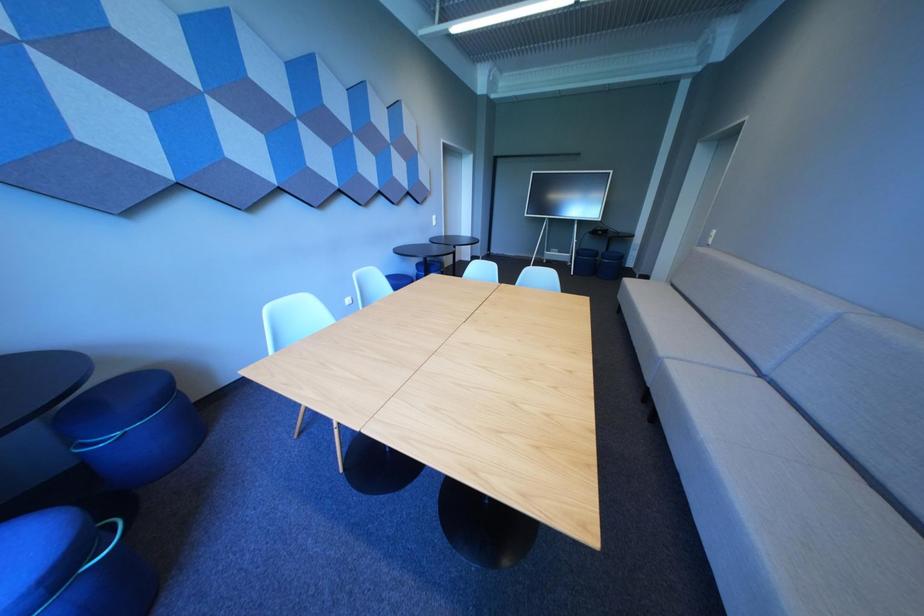
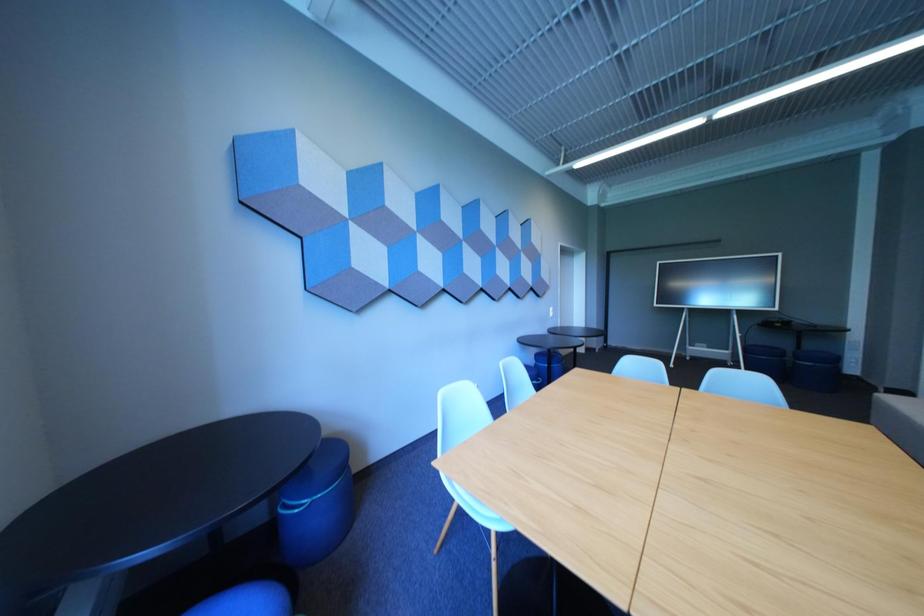
How did the camera likely rotate?

The camera rotated toward left-up.